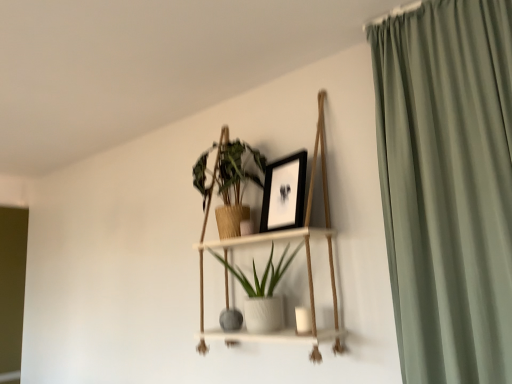
Question: Is matte gray vase at center outside black matte picture frame at upper center?

Choices:
 (A) yes
 (B) no

Answer: (A)

Question: Is matte gray vase at center to the left of black matte picture frame at upper center from the viewer's perspective?

Choices:
 (A) no
 (B) yes

Answer: (B)

Question: Considering the relative positions of matte gray vase at center and black matte picture frame at upper center in the image provided, is matte gray vase at center behind black matte picture frame at upper center?

Choices:
 (A) no
 (B) yes

Answer: (B)

Question: Is matte gray vase at center far from black matte picture frame at upper center?

Choices:
 (A) no
 (B) yes

Answer: (A)

Question: Can you confirm if matte gray vase at center is smaller than black matte picture frame at upper center?

Choices:
 (A) yes
 (B) no

Answer: (A)

Question: Is matte gray vase at center with black matte picture frame at upper center?

Choices:
 (A) no
 (B) yes

Answer: (A)

Question: Does green matte plant at upper center, which appears as the 1th houseplant when viewed from the top, have a larger size compared to matte gray vase at center?

Choices:
 (A) yes
 (B) no

Answer: (A)

Question: Can you confirm if green matte plant at upper center, which appears as the 1th houseplant when viewed from the top, is taller than matte gray vase at center?

Choices:
 (A) yes
 (B) no

Answer: (A)

Question: Is green matte plant at upper center, the second houseplant ordered from the bottom, not inside matte gray vase at center?

Choices:
 (A) no
 (B) yes

Answer: (B)

Question: Is green matte plant at upper center, the second houseplant ordered from the bottom, looking in the opposite direction of matte gray vase at center?

Choices:
 (A) no
 (B) yes

Answer: (A)

Question: Could you tell me if green matte plant at upper center, which appears as the 1th houseplant when viewed from the top, is facing matte gray vase at center?

Choices:
 (A) no
 (B) yes

Answer: (A)

Question: Does green matte plant at upper center, which appears as the 1th houseplant when viewed from the top, have a smaller size compared to matte gray vase at center?

Choices:
 (A) no
 (B) yes

Answer: (A)

Question: Is matte gray vase at center inside white wood shelf at center?

Choices:
 (A) no
 (B) yes

Answer: (B)